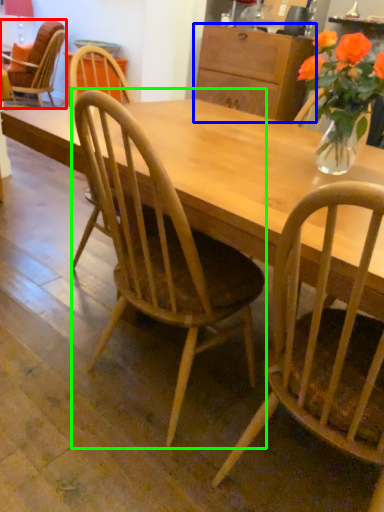
Question: Considering the real-world distances, which object is farthest from chair (highlighted by a red box)? cabinetry (highlighted by a blue box) or chair (highlighted by a green box)?

Choices:
 (A) cabinetry
 (B) chair

Answer: (B)